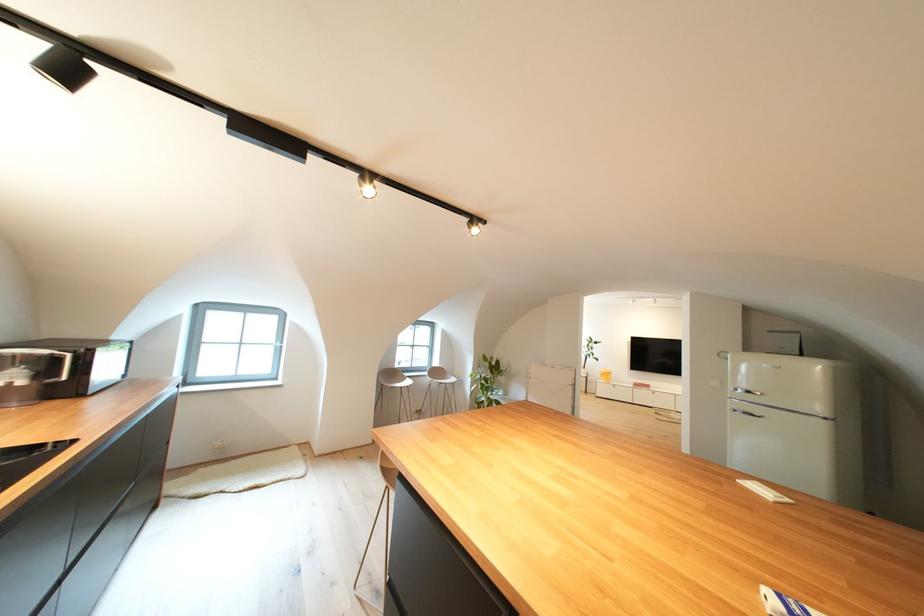
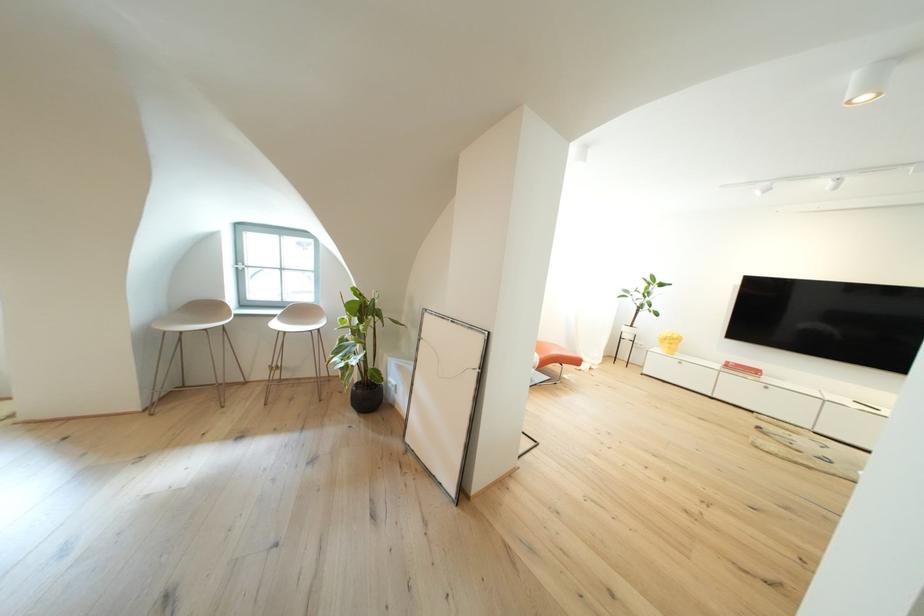
Which direction would the cameraman need to move to produce the second image?

The cameraman moved toward right, forward.